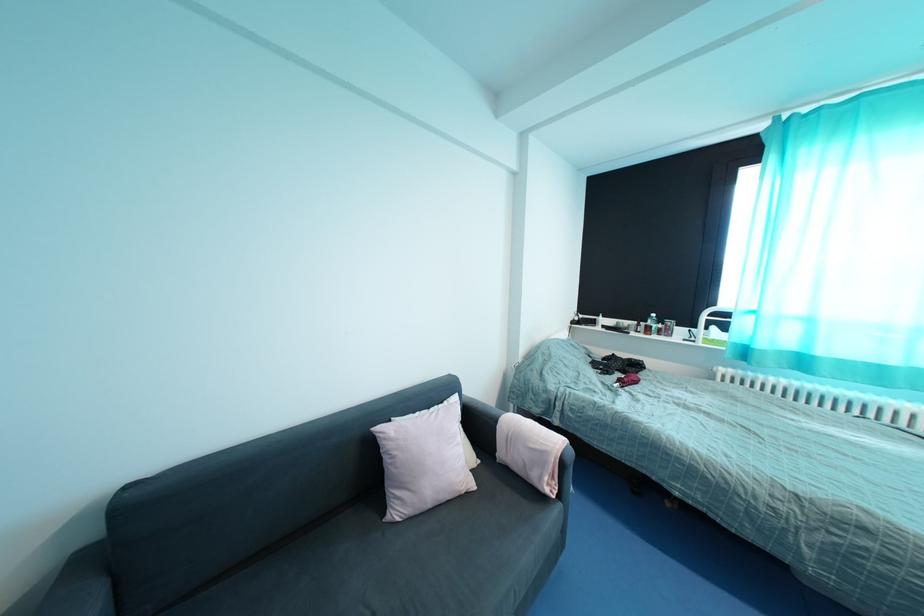
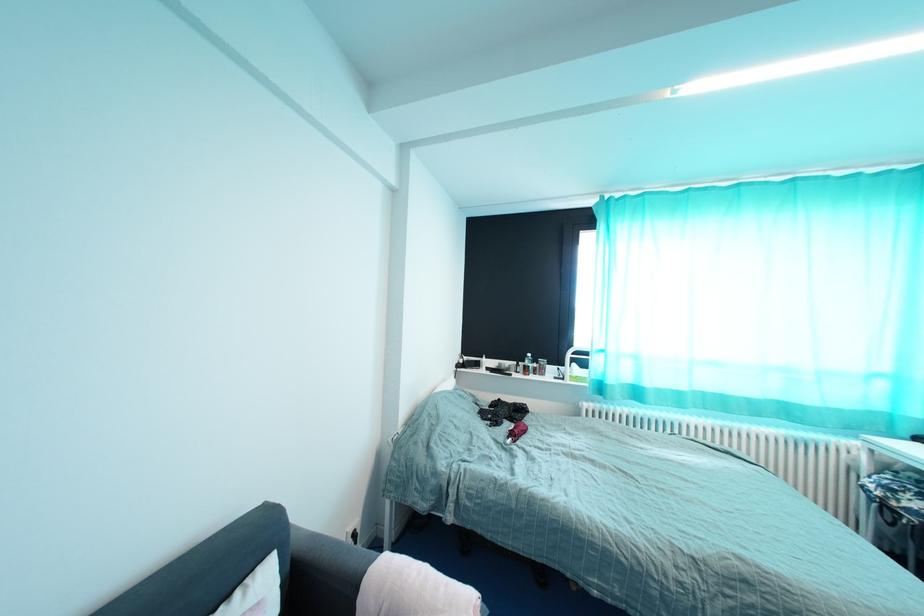
Question: How did the camera likely rotate?

Choices:
 (A) Left
 (B) Right
 (C) Up
 (D) Down

Answer: (B)